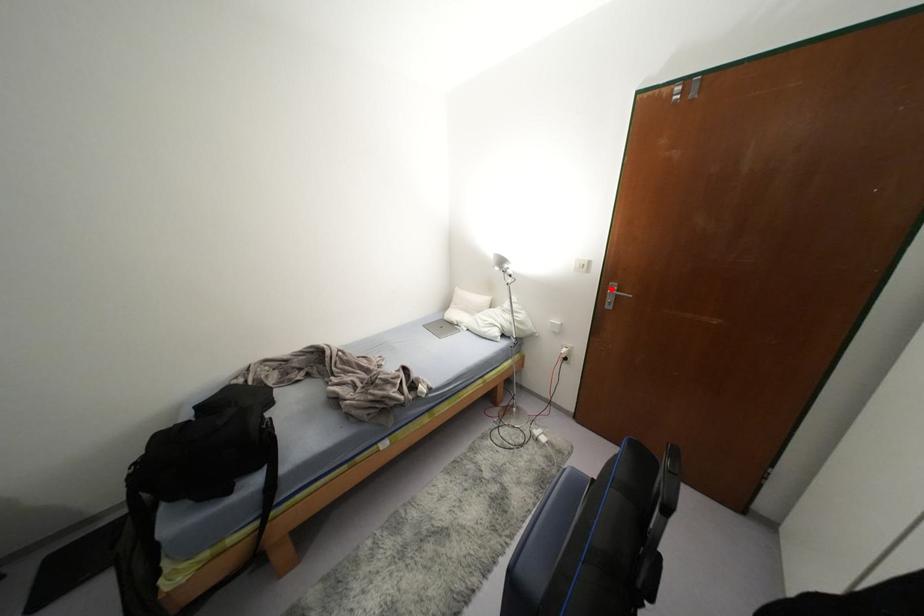
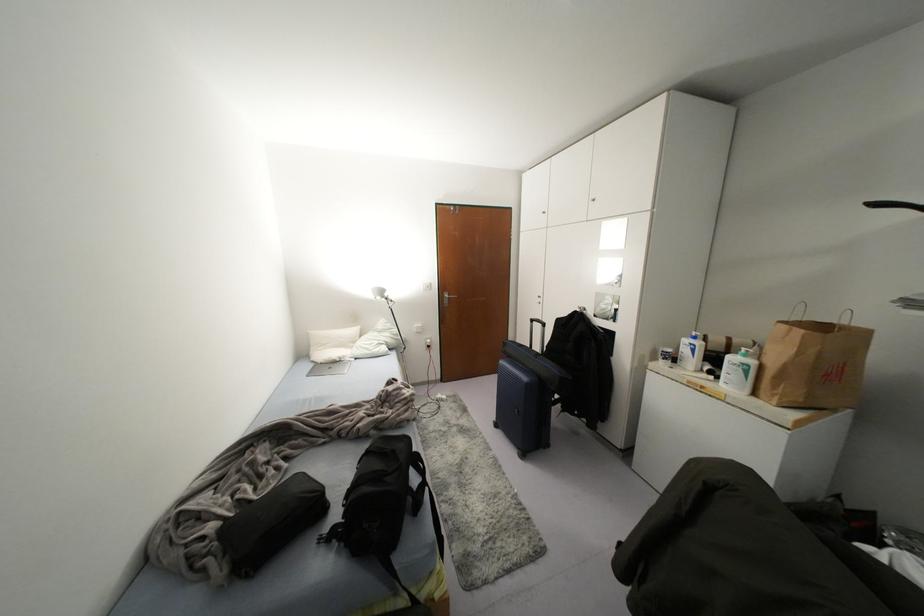
In the second image, find the point that corresponds to the highlighted location in the first image.

(445, 296)